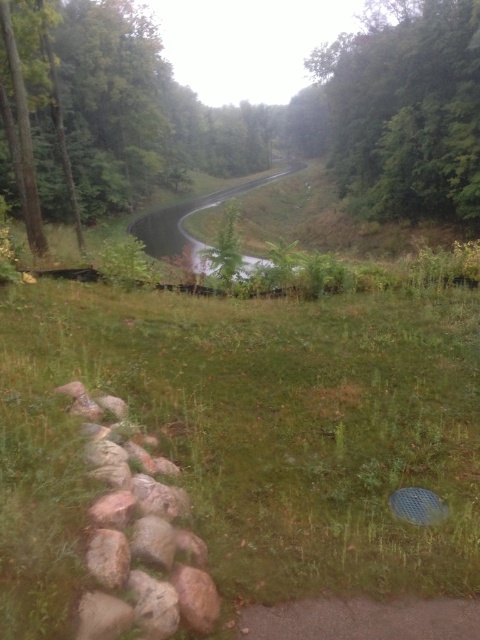
Question: Considering the real-world distances, which object is farthest from the green grassy at center?

Choices:
 (A) green leafy tree at upper right
 (B) green leafy tree at upper center

Answer: (B)

Question: Does green grassy at center have a greater width compared to green leafy tree at upper center?

Choices:
 (A) yes
 (B) no

Answer: (B)

Question: Is green grassy at center positioned behind green leafy tree at upper center?

Choices:
 (A) yes
 (B) no

Answer: (B)

Question: Does green grassy at center appear on the right side of green leafy tree at upper right?

Choices:
 (A) no
 (B) yes

Answer: (A)

Question: Which of these objects is positioned closest to the green leafy tree at upper center?

Choices:
 (A) green grassy at center
 (B) green leafy tree at upper right

Answer: (B)

Question: Which object is closer to the camera taking this photo?

Choices:
 (A) green leafy tree at upper center
 (B) green grassy at center
 (C) green leafy tree at upper right

Answer: (B)